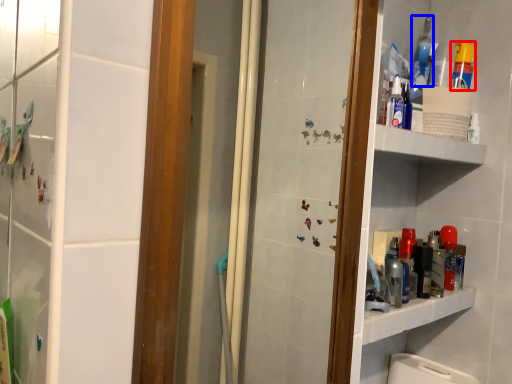
Question: Among these objects, which one is nearest to the camera, cleaning product (highlighted by a red box) or mouthwash (highlighted by a blue box)?

Choices:
 (A) cleaning product
 (B) mouthwash

Answer: (A)